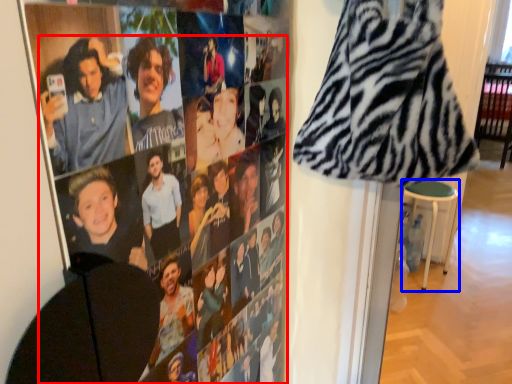
Question: Among these objects, which one is farthest to the camera, person (highlighted by a red box) or bar stool (highlighted by a blue box)?

Choices:
 (A) person
 (B) bar stool

Answer: (B)